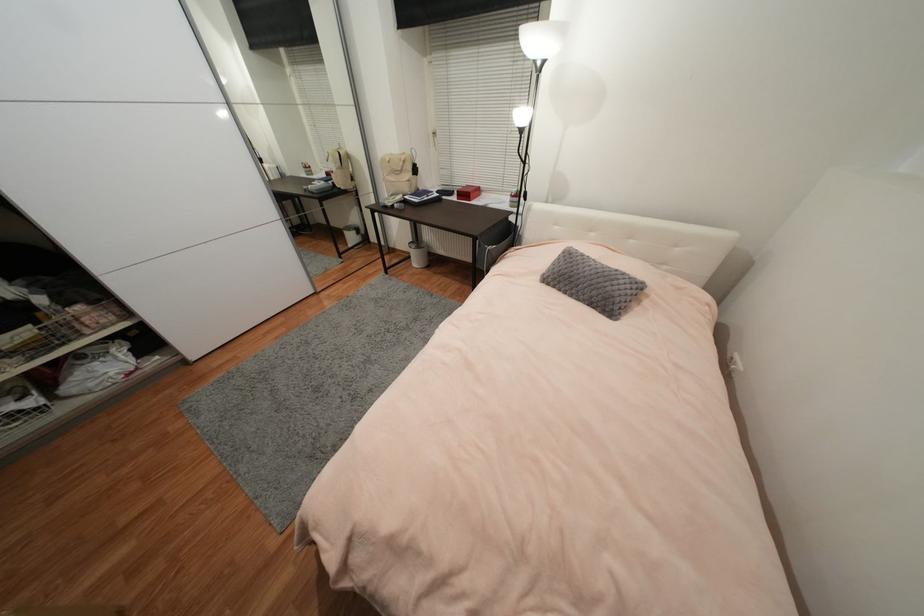
The width and height of the screenshot is (924, 616). Identify the location of lamp switch. (518, 193).